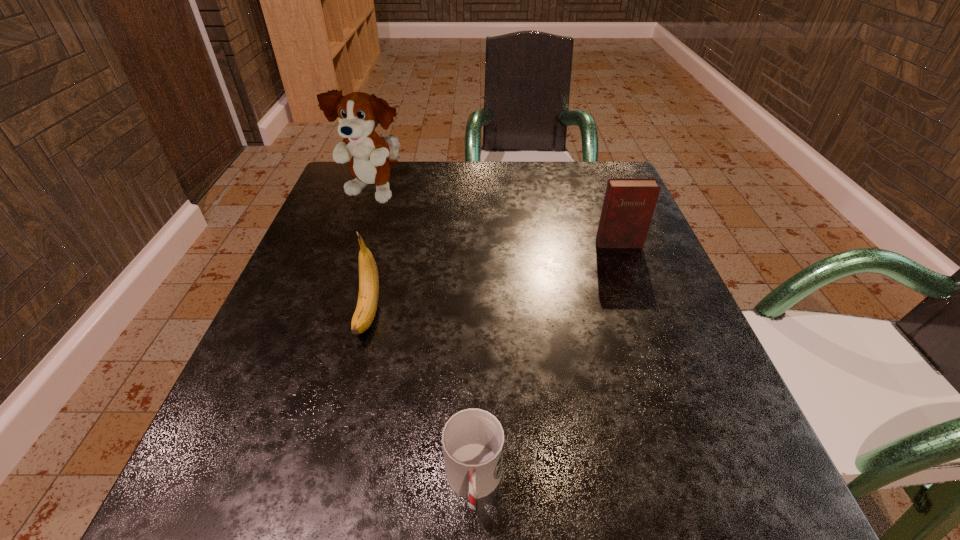
Where is `the tallest object`? the tallest object is located at coordinates (359, 113).

Find the location of a particular element. This screenshot has width=960, height=540. puppy is located at coordinates (359, 113).

Identify the location of the third nearest object. The height and width of the screenshot is (540, 960). (629, 203).

Where is `the rightmost object`? the rightmost object is located at coordinates (629, 203).

Where is `banana`? This screenshot has width=960, height=540. banana is located at coordinates (364, 314).

Locate an element on the screen. This screenshot has height=540, width=960. the nearest object is located at coordinates (473, 439).

Find the location of `cup`. cup is located at coordinates (473, 439).

Where is `vacant region located on the face of the tallest object`? The width and height of the screenshot is (960, 540). vacant region located on the face of the tallest object is located at coordinates (329, 328).

The height and width of the screenshot is (540, 960). In order to click on vacant space positioned on the front cover of the diary in this screenshot , I will do `click(677, 397)`.

Find the location of `free region located 0.190m at the start of the peel on the banana`. free region located 0.190m at the start of the peel on the banana is located at coordinates (329, 467).